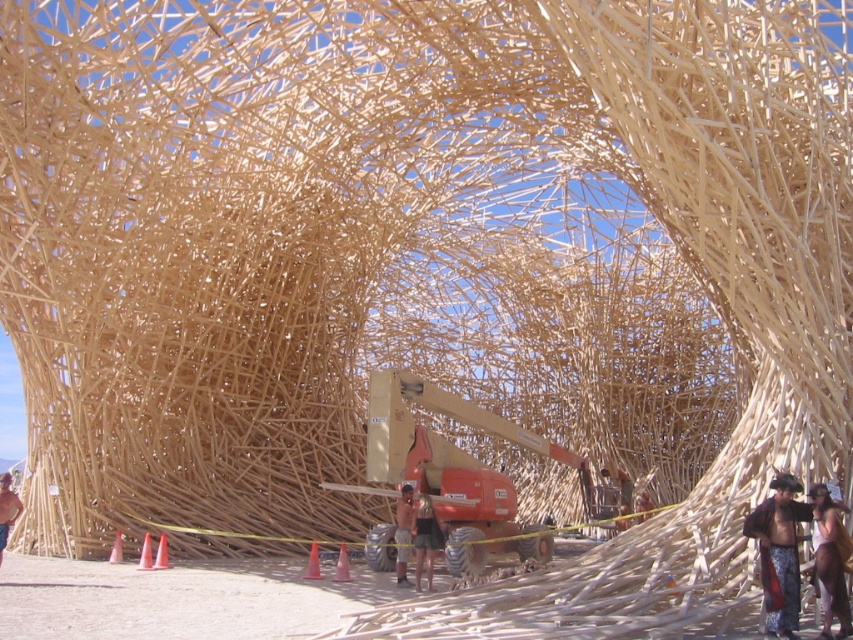
Between shiny metallic helmet at lower right and orange plastic cone at center, which one is positioned lower?

orange plastic cone at center is lower down.

Is shiny metallic helmet at lower right smaller than orange plastic cone at center?

Correct, shiny metallic helmet at lower right occupies less space than orange plastic cone at center.

Locate an element on the screen. The image size is (853, 640). shiny metallic helmet at lower right is located at coordinates (x=779, y=552).

Is point (850, 554) positioned before point (120, 538)?

Yes, point (850, 554) is in front of point (120, 538).

Where is `leather vest at center`? leather vest at center is located at coordinates (830, 561).

Is leather vest at center bigger than pink plastic cone at lower center?

No, leather vest at center is not bigger than pink plastic cone at lower center.

Is leather vest at center closer to the viewer compared to pink plastic cone at lower center?

Yes, it is.

Image resolution: width=853 pixels, height=640 pixels. I want to click on leather vest at center, so click(x=830, y=561).